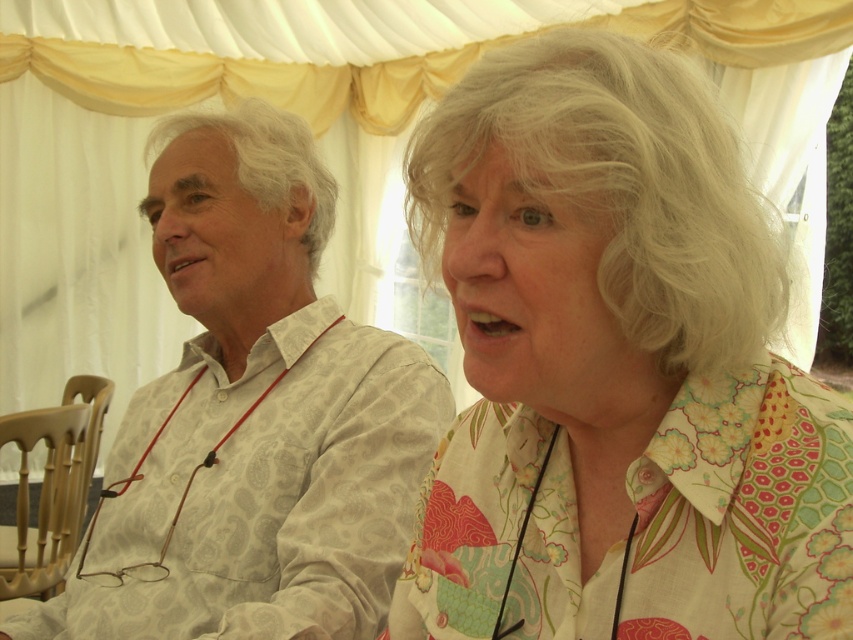
You are standing in front of the tent structure and want to hang a decoration between the two points, point (769,394) and point (181,410). Which point is closer to you so the decoration can be easily reached?

Point (769,394) is closer to the camera than point (181,410), so the decoration should be placed closer to point (769,394) for easier reach.

You are standing in front of the tent structure and see the point marked at coordinates [616,369]. What object is located at that position?

The point at coordinates [616,369] marks the floral cotton blouse at upper right.

You are an interior designer arranging a photoshoot setup. You need to place a small decorative pillow between the floral cotton blouse at upper right and the white paisley shirt at left. Based on their sizes, which object should the pillow be closer to?

The floral cotton blouse at upper right has a smaller size compared to the white paisley shirt at left, so the pillow should be placed closer to the floral cotton blouse at upper right to balance the sizes.